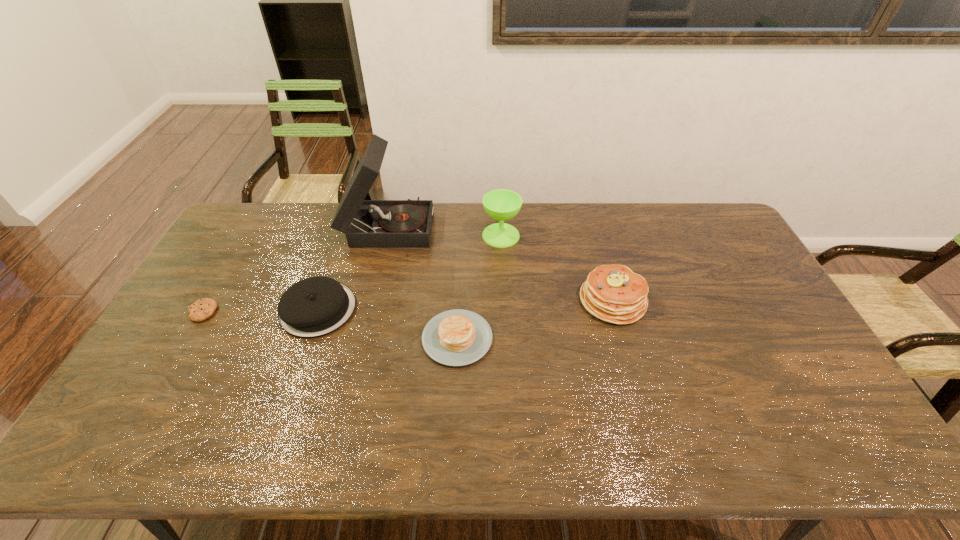
At what (x,y) coordinates should I click in order to perform the action: click on vacant position located 0.390m on the front-facing side of the phonograph_record. Please return your answer as a coordinate pair (x, y). The height and width of the screenshot is (540, 960). Looking at the image, I should click on (539, 226).

The width and height of the screenshot is (960, 540). I want to click on free space located on the back of the second tallest object, so click(x=499, y=203).

At what (x,y) coordinates should I click in order to perform the action: click on vacant region located on the back of the tallest pancake. Please return your answer as a coordinate pair (x, y). Looking at the image, I should click on (590, 224).

Locate an element on the screen. This screenshot has height=540, width=960. blank area located 0.370m on the right of the fourth tallest object is located at coordinates tap(477, 309).

Locate an element on the screen. Image resolution: width=960 pixels, height=540 pixels. vacant position located on the back of the second pancake from right to left is located at coordinates (461, 266).

You are a GUI agent. You are given a task and a screenshot of the screen. Output one action in this format:
    pyautogui.click(x=<x>, y=<y>)
    Task: Click on the blank space located 0.070m on the right of the cookie
    
    Given the screenshot: What is the action you would take?
    pyautogui.click(x=240, y=312)

Identify the location of phonograph_record located at the far edge. This screenshot has height=540, width=960. (408, 223).

Where is `wineglass located in the far edge section of the desktop`? This screenshot has width=960, height=540. wineglass located in the far edge section of the desktop is located at coordinates (501, 204).

Where is `object located at the left edge`? This screenshot has height=540, width=960. object located at the left edge is located at coordinates [x=202, y=309].

You are a GUI agent. You are given a task and a screenshot of the screen. Output one action in this format:
    pyautogui.click(x=<x>, y=<y>)
    Task: Click on the vacant point at the far edge
    
    Given the screenshot: What is the action you would take?
    pyautogui.click(x=518, y=219)